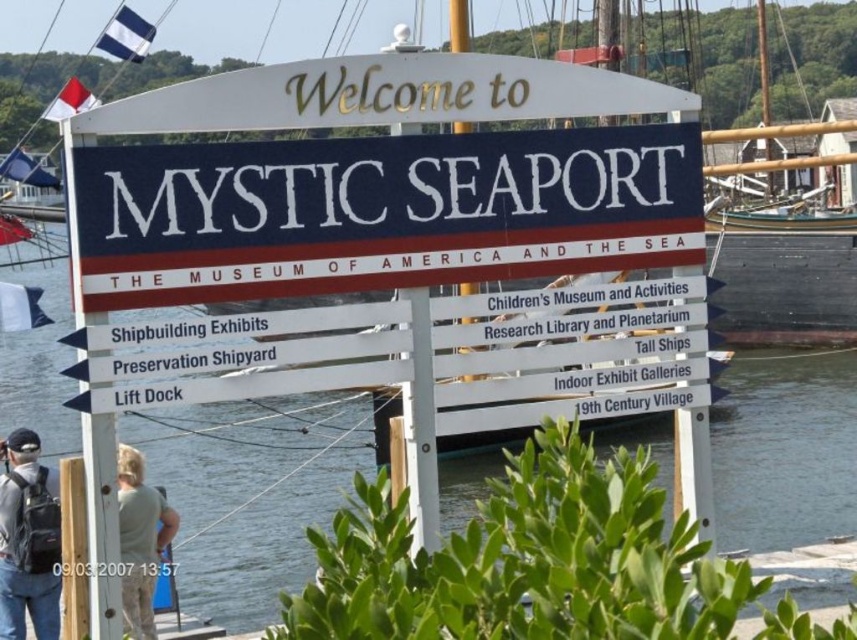
Is white painted wood sign at center above green fabric shirt at lower left?

Yes.

The image size is (857, 640). What do you see at coordinates (381, 211) in the screenshot?
I see `white painted wood sign at center` at bounding box center [381, 211].

What are the coordinates of `white painted wood sign at center` in the screenshot? It's located at (381, 211).

The image size is (857, 640). I want to click on white painted wood sign at center, so click(381, 211).

Who is higher up, white painted wood sign at center or clear water at center?

white painted wood sign at center is higher up.

Which is behind, point (267, 211) or point (758, 536)?

The point (758, 536) is more distant.

Where is `white painted wood sign at center`? This screenshot has height=640, width=857. white painted wood sign at center is located at coordinates (381, 211).

Is white painted wood sign at center positioned at the back of matte black backpack at lower left?

That is False.

Which is behind, point (213, 298) or point (36, 632)?

The point (36, 632) is behind.

Does point (406, 156) come closer to viewer compared to point (9, 464)?

Yes, it is in front of point (9, 464).

I want to click on white painted wood sign at center, so click(x=381, y=211).